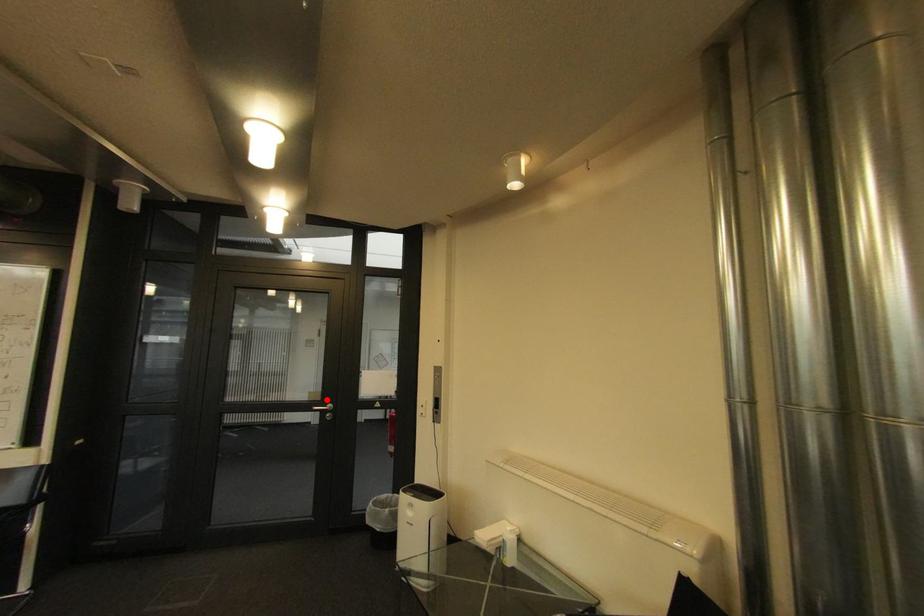
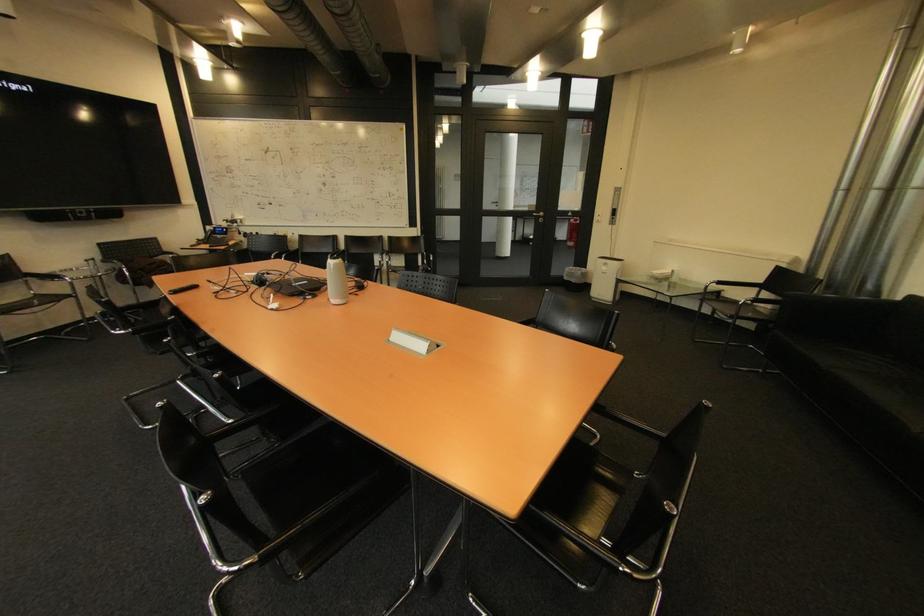
Locate, in the second image, the point that corresponds to the highlighted location in the first image.

(542, 209)